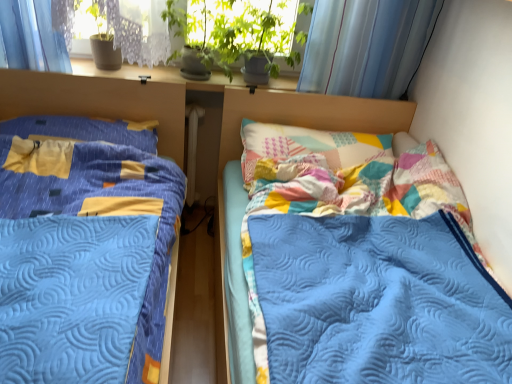
Question: Is quilted blue blanket at center, arranged as the second bed when viewed from the left, not near yellow fabric pillow at left?

Choices:
 (A) no
 (B) yes

Answer: (A)

Question: Is quilted blue blanket at center, which appears as the first bed when viewed from the right, further to camera compared to yellow fabric pillow at left?

Choices:
 (A) no
 (B) yes

Answer: (A)

Question: Is quilted blue blanket at center, arranged as the second bed when viewed from the left, oriented towards yellow fabric pillow at left?

Choices:
 (A) yes
 (B) no

Answer: (B)

Question: Is quilted blue blanket at center, which appears as the first bed when viewed from the right, surrounding yellow fabric pillow at left?

Choices:
 (A) yes
 (B) no

Answer: (B)

Question: From a real-world perspective, is quilted blue blanket at center, arranged as the second bed when viewed from the left, positioned under yellow fabric pillow at left based on gravity?

Choices:
 (A) yes
 (B) no

Answer: (A)

Question: From a real-world perspective, is yellow fabric pillow at left physically located above or below quilted blue blanket at center, which appears as the first bed when viewed from the right?

Choices:
 (A) above
 (B) below

Answer: (A)

Question: In the image, is yellow fabric pillow at left positioned in front of or behind quilted blue blanket at center, which appears as the first bed when viewed from the right?

Choices:
 (A) behind
 (B) front

Answer: (A)

Question: From their relative heights in the image, would you say yellow fabric pillow at left is taller or shorter than quilted blue blanket at center, which appears as the first bed when viewed from the right?

Choices:
 (A) tall
 (B) short

Answer: (B)

Question: Is yellow fabric pillow at left spatially inside quilted blue blanket at center, arranged as the second bed when viewed from the left, or outside of it?

Choices:
 (A) outside
 (B) inside

Answer: (A)

Question: From their relative heights in the image, would you say quilted blue blanket at center, arranged as the second bed when viewed from the left, is taller or shorter than white plastic radiator at center?

Choices:
 (A) short
 (B) tall

Answer: (B)

Question: Relative to white plastic radiator at center, is quilted blue blanket at center, arranged as the second bed when viewed from the left, in front or behind?

Choices:
 (A) front
 (B) behind

Answer: (A)

Question: From a real-world perspective, is quilted blue blanket at center, which appears as the first bed when viewed from the right, above or below white plastic radiator at center?

Choices:
 (A) below
 (B) above

Answer: (B)

Question: In the image, is quilted blue blanket at center, arranged as the second bed when viewed from the left, on the left side or the right side of white plastic radiator at center?

Choices:
 (A) right
 (B) left

Answer: (A)

Question: Choose the correct answer: Is yellow fabric pillow at left inside blue quilted bed at left, which is counted as the 2th bed, starting from the right, or outside it?

Choices:
 (A) outside
 (B) inside

Answer: (B)

Question: In terms of height, does yellow fabric pillow at left look taller or shorter compared to blue quilted bed at left, which is counted as the 2th bed, starting from the right?

Choices:
 (A) short
 (B) tall

Answer: (A)